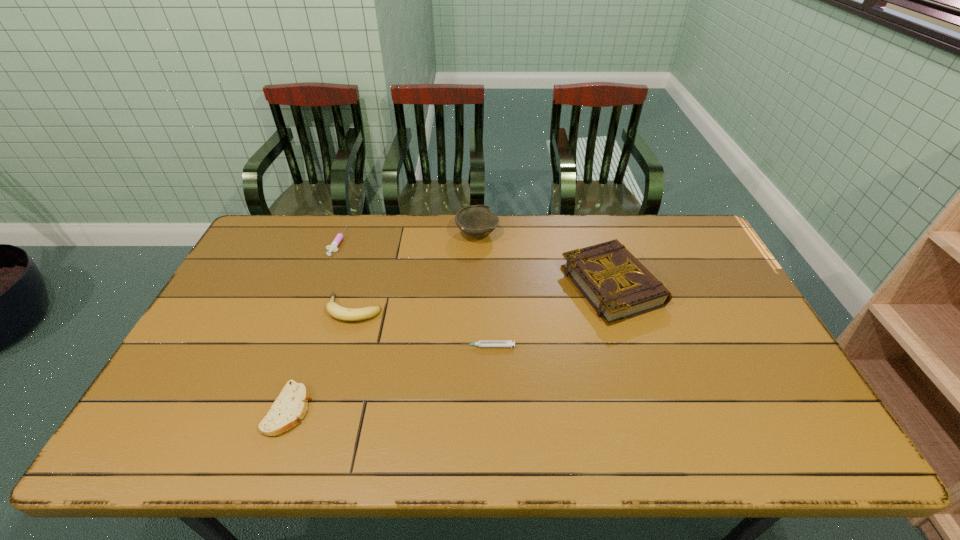
You are a GUI agent. You are given a task and a screenshot of the screen. Output one action in this format:
    pyautogui.click(x=<x>, y=<y>)
    Task: Click on the free spot at the far edge of the desktop
    Image resolution: width=960 pixels, height=540 pixels.
    Given the screenshot: What is the action you would take?
    pyautogui.click(x=353, y=218)

In the image, there is a desktop. At what (x,y) coordinates should I click in order to perform the action: click on vacant region at the near edge. Please return your answer as a coordinate pair (x, y). Looking at the image, I should click on (726, 447).

Where is `blank space at the right edge`? blank space at the right edge is located at coordinates (691, 299).

What are the coordinates of `free spot at the far left corner of the desktop` in the screenshot? It's located at (282, 246).

The width and height of the screenshot is (960, 540). In order to click on free space between the bowl and the third tallest object in this screenshot , I will do `click(416, 272)`.

Find the location of a particular element. Image resolution: width=960 pixels, height=540 pixels. free space between the pita bread and the bowl is located at coordinates (383, 321).

Identify the location of vacant region between the pita bread and the hardback book. (450, 347).

The image size is (960, 540). Identify the location of unoccupied area between the farther syringe and the bowl. (407, 238).

The image size is (960, 540). What are the coordinates of `vacant region between the nearer syringe and the fourth shortest object` in the screenshot? It's located at (421, 328).

Where is `empty space between the rightmost object and the nearest object`? empty space between the rightmost object and the nearest object is located at coordinates (450, 347).